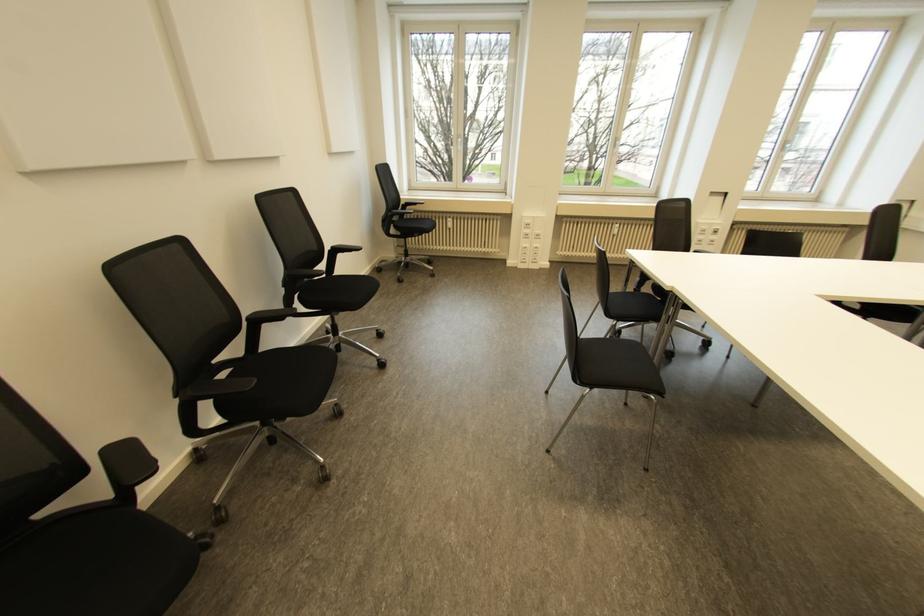
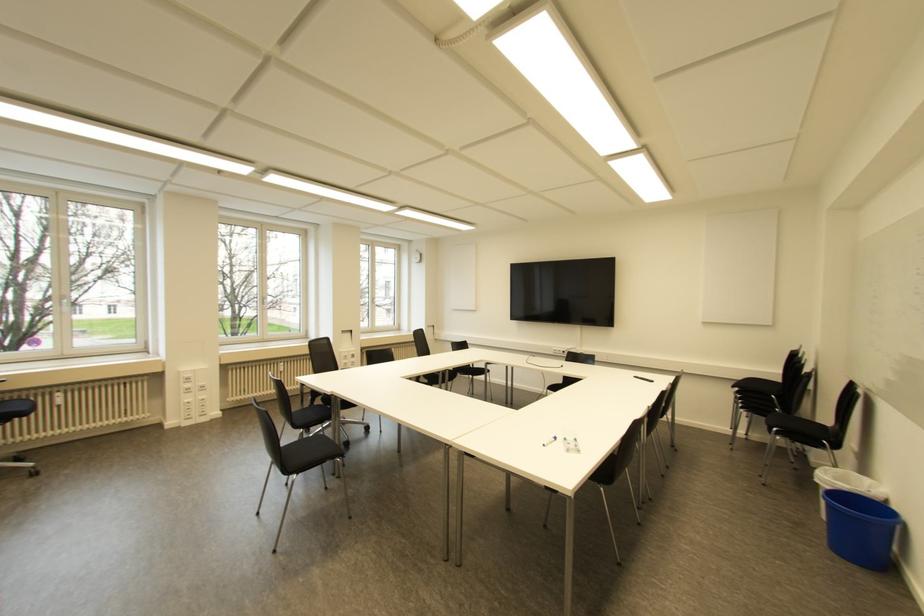
Find the pixel in the second image that matches (660,392) in the first image.

(342, 455)